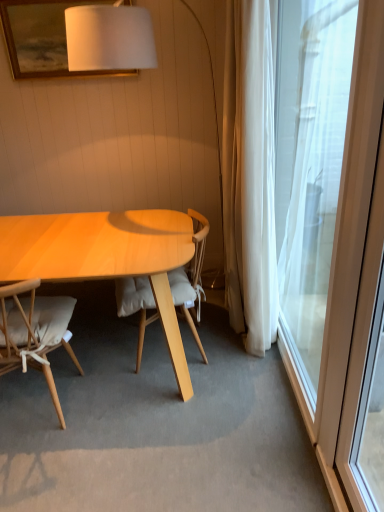
At what (x,y) coordinates should I click in order to perform the action: click on free space below light brown wood chair at left, acting as the first chair starting from the left (from a real-world perspective). Please return your answer as a coordinate pair (x, y). The width and height of the screenshot is (384, 512). Looking at the image, I should click on (34, 402).